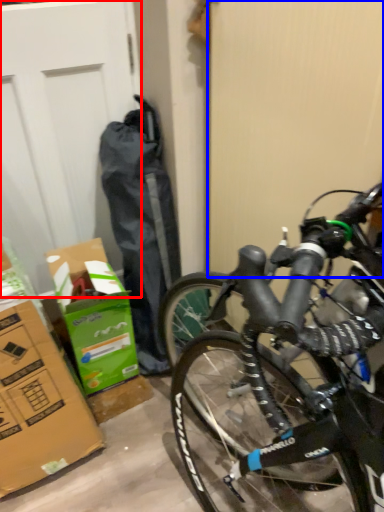
Question: Among these objects, which one is nearest to the camera, garage door (highlighted by a red box) or screen door (highlighted by a blue box)?

Choices:
 (A) garage door
 (B) screen door

Answer: (B)